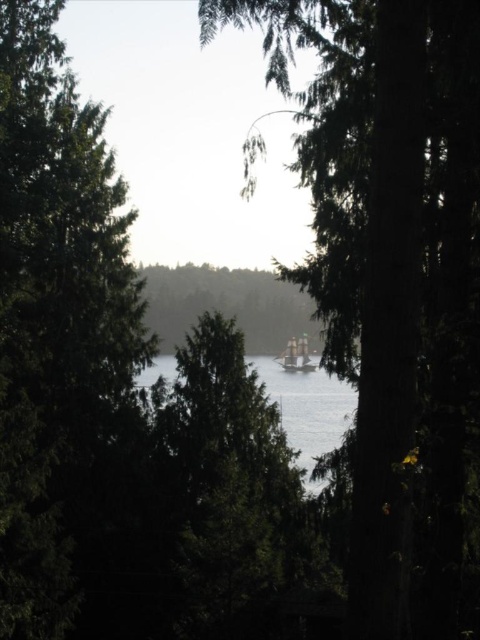
You are standing in the forest looking towards the water. You see a green matte tree at center and a wooden ship at center. Which object is positioned to the left when facing the water?

The green matte tree at center is to the left of the wooden ship at center, so when facing the water, the green matte tree at center is positioned to the left.